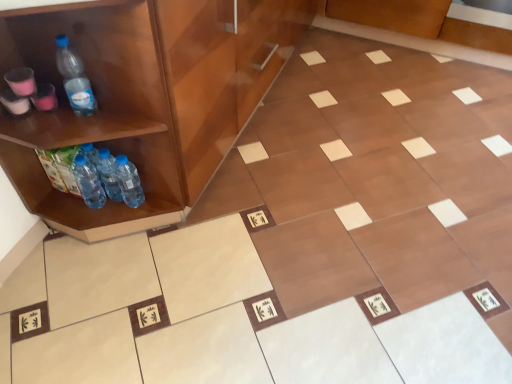
Question: Is transparent plastic bottle at left, acting as the second bottle starting from the left, not close to blue plastic bottle at lower left, the fourth bottle viewed from the right?

Choices:
 (A) no
 (B) yes

Answer: (A)

Question: Could blue plastic bottle at lower left, the fourth bottle viewed from the right, be considered to be inside transparent plastic bottle at left, the 3th bottle positioned from the right?

Choices:
 (A) no
 (B) yes

Answer: (A)

Question: Is transparent plastic bottle at left, acting as the second bottle starting from the left, positioned beyond the bounds of blue plastic bottle at lower left, the fourth bottle viewed from the right?

Choices:
 (A) yes
 (B) no

Answer: (A)

Question: Considering the relative sizes of transparent plastic bottle at left, the 3th bottle positioned from the right, and blue plastic bottle at lower left, the fourth bottle viewed from the right, in the image provided, is transparent plastic bottle at left, the 3th bottle positioned from the right, shorter than blue plastic bottle at lower left, the fourth bottle viewed from the right,?

Choices:
 (A) yes
 (B) no

Answer: (B)

Question: Is transparent plastic bottle at left, acting as the second bottle starting from the left, behind blue plastic bottle at lower left, which is the 1th bottle in left-to-right order?

Choices:
 (A) yes
 (B) no

Answer: (B)

Question: In the image, is transparent plastic bottle at left, acting as the second bottle starting from the left, positioned in front of or behind translucent plastic bottles at left, the second bottle positioned from the right?

Choices:
 (A) behind
 (B) front

Answer: (B)

Question: Looking at the image, does transparent plastic bottle at left, the 3th bottle positioned from the right, seem bigger or smaller compared to translucent plastic bottles at left, acting as the third bottle starting from the left?

Choices:
 (A) small
 (B) big

Answer: (A)

Question: From their relative heights in the image, would you say transparent plastic bottle at left, acting as the second bottle starting from the left, is taller or shorter than translucent plastic bottles at left, acting as the third bottle starting from the left?

Choices:
 (A) short
 (B) tall

Answer: (B)

Question: From a real-world perspective, relative to translucent plastic bottles at left, acting as the third bottle starting from the left, is transparent plastic bottle at left, acting as the second bottle starting from the left, vertically above or below?

Choices:
 (A) above
 (B) below

Answer: (A)

Question: In the image, is transparent plastic bottle at left, the 3th bottle positioned from the right, on the left side or the right side of translucent plastic bottles at lower left, the first bottle viewed from the right?

Choices:
 (A) left
 (B) right

Answer: (A)

Question: In terms of height, does transparent plastic bottle at left, acting as the second bottle starting from the left, look taller or shorter compared to translucent plastic bottles at lower left, placed as the fourth bottle when sorted from left to right?

Choices:
 (A) tall
 (B) short

Answer: (A)

Question: From the image's perspective, is transparent plastic bottle at left, the 3th bottle positioned from the right, located above or below translucent plastic bottles at lower left, placed as the fourth bottle when sorted from left to right?

Choices:
 (A) below
 (B) above

Answer: (B)

Question: From a real-world perspective, is transparent plastic bottle at left, acting as the second bottle starting from the left, positioned above or below translucent plastic bottles at lower left, placed as the fourth bottle when sorted from left to right?

Choices:
 (A) below
 (B) above

Answer: (B)

Question: From a real-world perspective, is transparent plastic bottle at left, the 3th bottle positioned from the right, above or below blue plastic bottle at lower left, the fourth bottle viewed from the right?

Choices:
 (A) below
 (B) above

Answer: (B)

Question: Considering the positions of transparent plastic bottle at left, acting as the second bottle starting from the left, and blue plastic bottle at lower left, which is the 1th bottle in left-to-right order, in the image, is transparent plastic bottle at left, acting as the second bottle starting from the left, taller or shorter than blue plastic bottle at lower left, which is the 1th bottle in left-to-right order,?

Choices:
 (A) tall
 (B) short

Answer: (A)